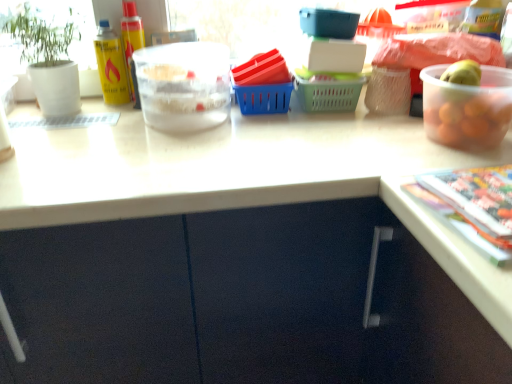
Locate an element on the screen. The width and height of the screenshot is (512, 384). vacant region to the left of translucent plastic bowl at upper center, positioned as the 2th bowl in front-to-back order is located at coordinates (88, 122).